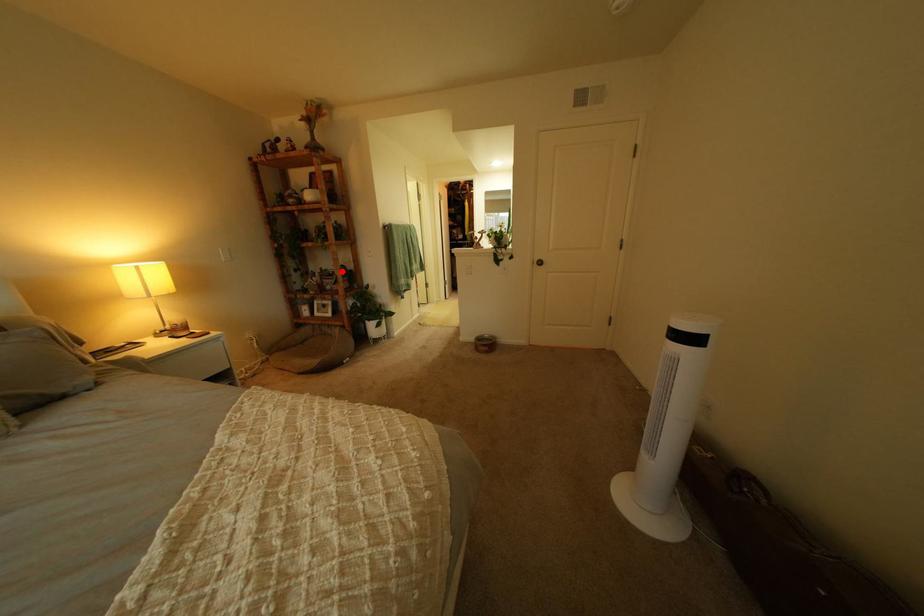
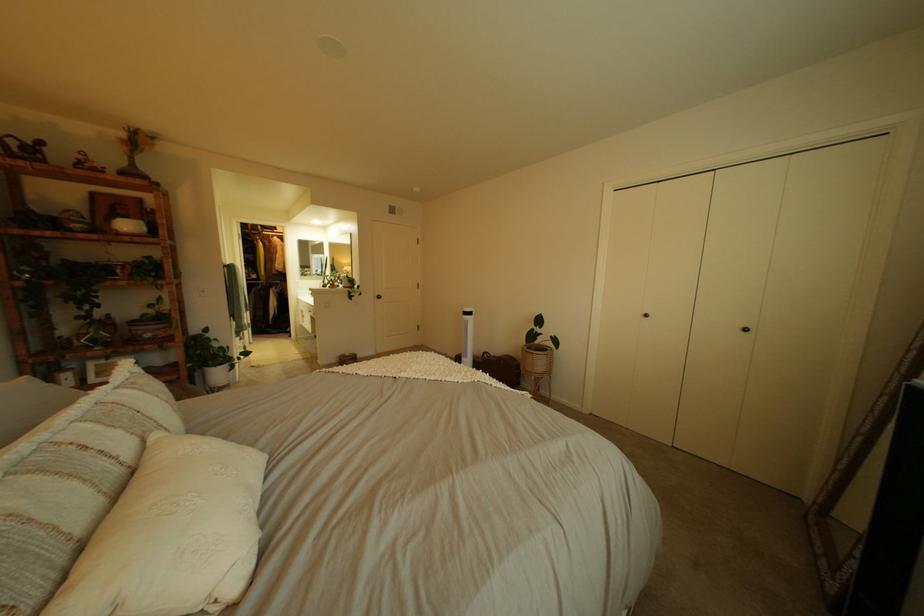
The point at the highlighted location is marked in the first image. Where is the corresponding point in the second image?

(161, 315)